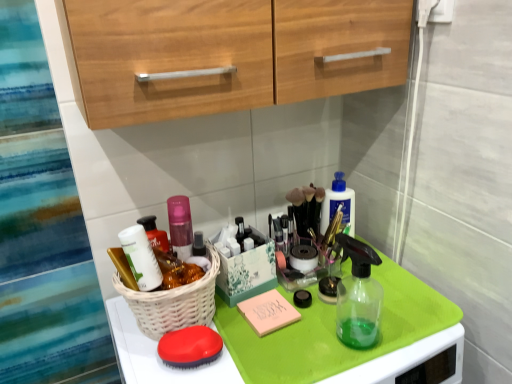
Question: Are white wicker basket at center and matte white container at center left far apart?

Choices:
 (A) no
 (B) yes

Answer: (A)

Question: From the image's perspective, is white wicker basket at center on matte white container at center left?

Choices:
 (A) yes
 (B) no

Answer: (B)

Question: From a real-world perspective, is white wicker basket at center positioned under matte white container at center left based on gravity?

Choices:
 (A) yes
 (B) no

Answer: (A)

Question: Considering the relative sizes of white wicker basket at center and matte white container at center left in the image provided, is white wicker basket at center wider than matte white container at center left?

Choices:
 (A) no
 (B) yes

Answer: (B)

Question: From the image's perspective, is white wicker basket at center located beneath matte white container at center left?

Choices:
 (A) yes
 (B) no

Answer: (A)

Question: Can you confirm if white wicker basket at center is bigger than matte white container at center left?

Choices:
 (A) yes
 (B) no

Answer: (A)

Question: From the image's perspective, does matte white container at center left appear lower than white wicker basket at center?

Choices:
 (A) no
 (B) yes

Answer: (A)

Question: From a real-world perspective, is matte white container at center left positioned over white wicker basket at center based on gravity?

Choices:
 (A) yes
 (B) no

Answer: (A)

Question: Is matte white container at center left outside white wicker basket at center?

Choices:
 (A) no
 (B) yes

Answer: (A)

Question: Considering the relative sizes of matte white container at center left and white wicker basket at center in the image provided, is matte white container at center left thinner than white wicker basket at center?

Choices:
 (A) yes
 (B) no

Answer: (A)

Question: From a real-world perspective, does matte white container at center left sit lower than white wicker basket at center?

Choices:
 (A) no
 (B) yes

Answer: (A)

Question: Is the surface of matte white container at center left in direct contact with white wicker basket at center?

Choices:
 (A) yes
 (B) no

Answer: (A)

Question: Does matte white container at center left lie in front of matte red brush at lower center?

Choices:
 (A) no
 (B) yes

Answer: (A)